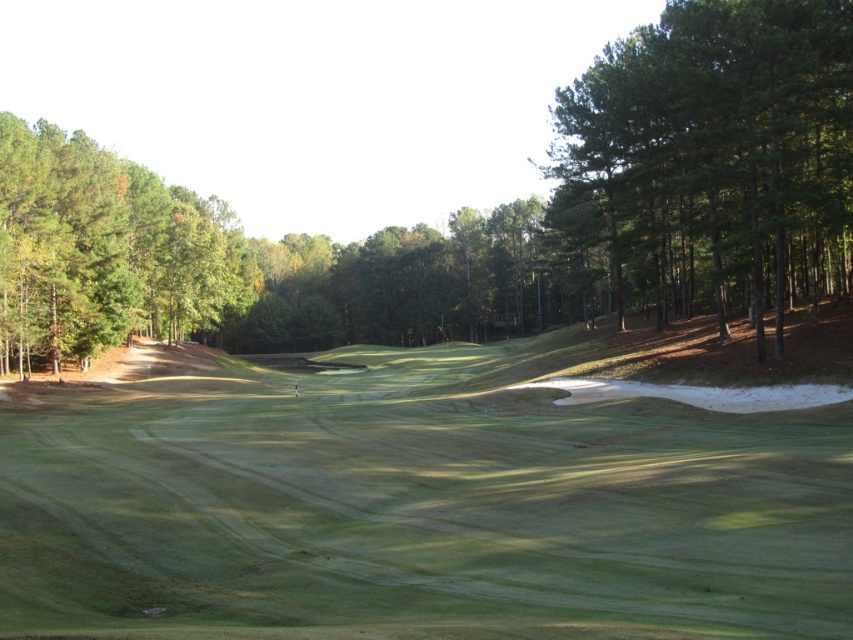
You are standing at the point labeled point (78, 209) and want to walk towards the point labeled point (624, 88). Given that both points are on the golf course fairway, which direction should you head?

You should head towards the direction where the point (624, 88) is located, which is closer to the camera compared to your current position at point (78, 209). Since the fairway slopes downward toward the sand trap on the right, you might need to walk uphill to reach the closer point.

You are a golfer standing on the fairway and want to determine which tree is taller between the green leafy trees at right and the green leafy tree at left. Based on the scene, which one is taller?

The green leafy trees at right is taller than the green leafy tree at left.

You are a golfer standing on the green grassy golf course at center and want to hit the ball towards the sand trap on the right. The green leafy tree at left is in your way. Can you see the sand trap on the right from your current position?

The green grassy golf course at center is positioned under green leafy tree at left, so the tree is blocking your view. You cannot see the sand trap on the right from your current position.